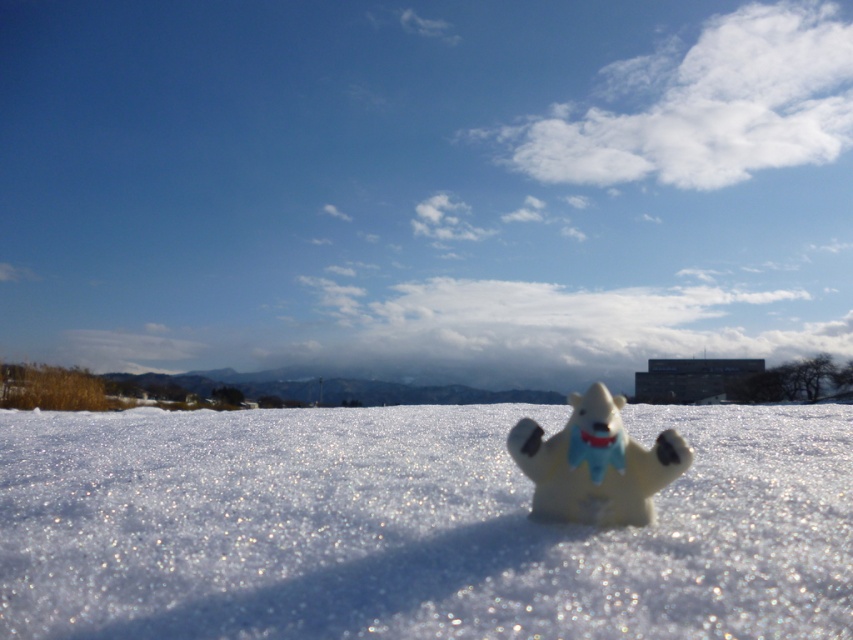
You are an observer looking at the winter scene. You see the white fluffy snow at center and the white matte polar bear at center. Which object takes up more space in the image?

The white fluffy snow at center takes up more space in the image than the white matte polar bear at center because it is bigger according to the description.

You are standing at the edge of the snow in the winter scene. You want to walk to the polar bear figure in the center. Is the point at coordinate (412, 525) on the path between you and the polar bear?

The point at coordinate (412, 525) is on white fluffy snow at center, so yes, the point is on the path between you and the polar bear.

You are an observer looking at the winter scene. You see the white fluffy snow at center and the white matte polar bear at center. Which object is positioned lower in the image?

The white fluffy snow at center is located below the white matte polar bear at center, so it is positioned lower in the image.